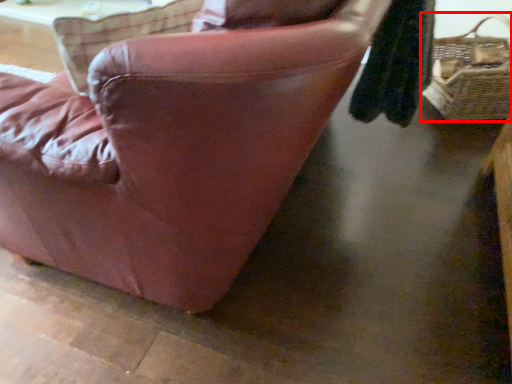
Question: From the image's perspective, what is the correct spatial positioning of picnic basket (annotated by the red box) in reference to chair?

Choices:
 (A) below
 (B) above

Answer: (B)